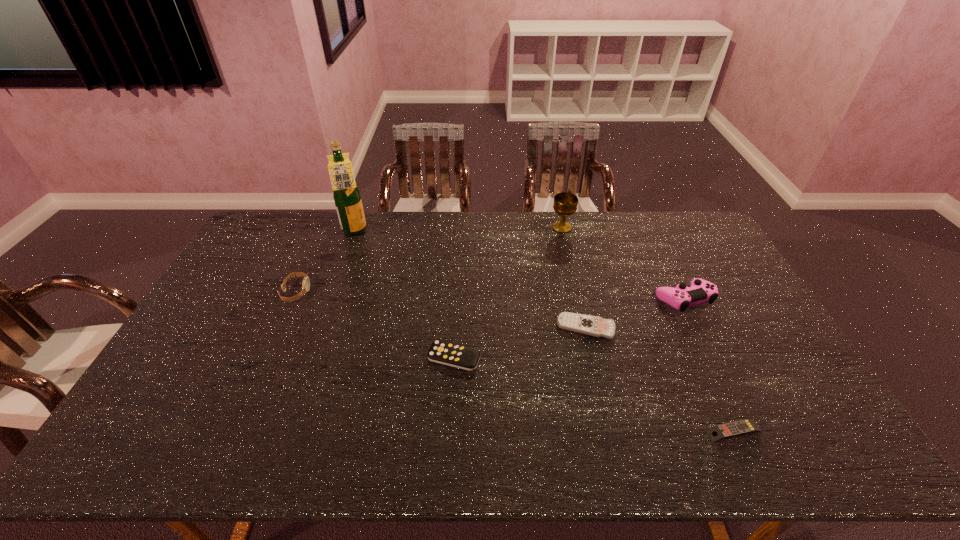
You are a GUI agent. You are given a task and a screenshot of the screen. Output one action in this format:
    pyautogui.click(x=<x>, y=<y>)
    Task: Click on the tallest object
    The image size is (960, 540).
    Given the screenshot: What is the action you would take?
    pyautogui.click(x=346, y=194)

Find the location of `liquor`. liquor is located at coordinates (346, 194).

The image size is (960, 540). I want to click on chalice, so click(565, 204).

At what (x,y) coordinates should I click in order to perform the action: click on the fifth shortest object. Please return your answer as a coordinate pair (x, y). The image size is (960, 540). Looking at the image, I should click on (700, 291).

Locate an element on the screen. the leftmost object is located at coordinates (306, 281).

This screenshot has height=540, width=960. Identify the location of the fourth tallest object. (306, 281).

I want to click on the second farthest remote control, so click(455, 355).

Identify the location of the second nearest object. (455, 355).

This screenshot has height=540, width=960. Find the location of `the second remote control from right to left`. the second remote control from right to left is located at coordinates (594, 326).

What are the coordinates of `the nearest remote control` in the screenshot? It's located at 746,426.